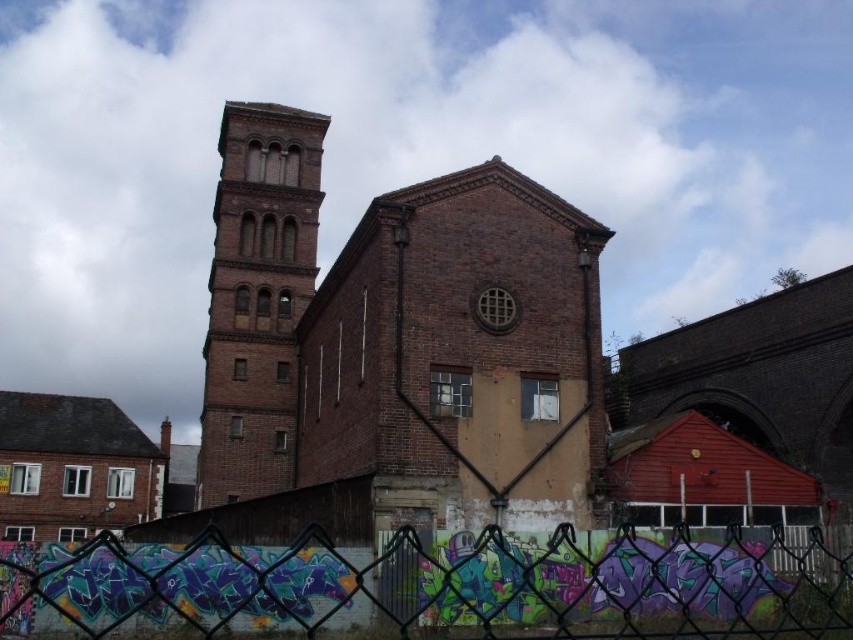
What do you see at coordinates (445, 582) in the screenshot? I see `metallic chain-link fence at lower center` at bounding box center [445, 582].

Consider the image. Who is shorter, metallic chain-link fence at lower center or brown brick tower at center-left?

metallic chain-link fence at lower center

Does point (384, 572) come closer to viewer compared to point (270, 396)?

Yes, point (384, 572) is closer to viewer.

You are a GUI agent. You are given a task and a screenshot of the screen. Output one action in this format:
    pyautogui.click(x=<x>, y=<y>)
    Task: Click on the metallic chain-link fence at lower center
    This screenshot has height=640, width=853.
    Given the screenshot: What is the action you would take?
    pyautogui.click(x=445, y=582)